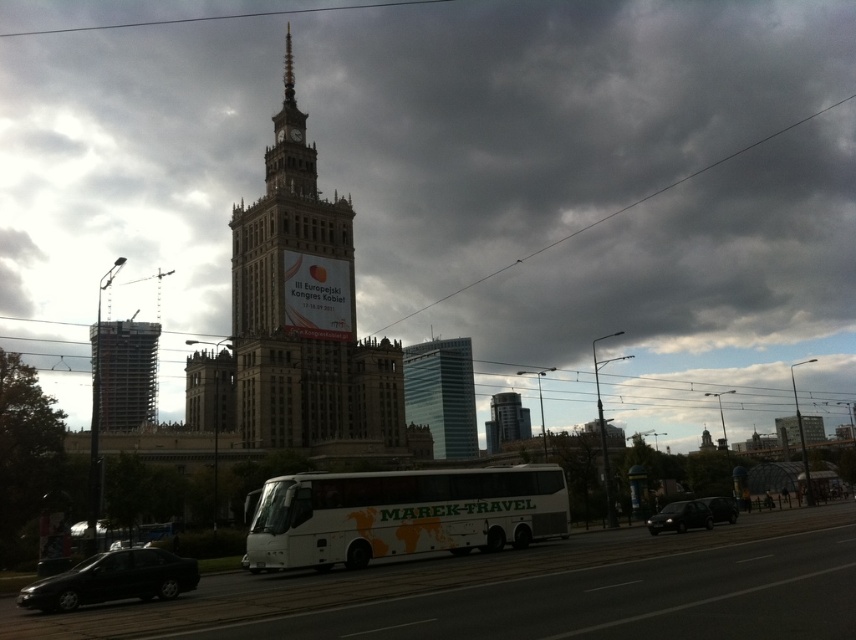
Can you confirm if matte gray skyscraper at center is smaller than shiny black sedan at lower left?

No, matte gray skyscraper at center is not smaller than shiny black sedan at lower left.

Looking at this image, does matte gray skyscraper at center have a lesser width compared to shiny black sedan at lower left?

In fact, matte gray skyscraper at center might be wider than shiny black sedan at lower left.

Does point (310, 4) lie behind point (122, 566)?

Yes, it is.

You are a GUI agent. You are given a task and a screenshot of the screen. Output one action in this format:
    pyautogui.click(x=<x>, y=<y>)
    Task: Click on the matte gray skyscraper at center
    
    Given the screenshot: What is the action you would take?
    pyautogui.click(x=461, y=180)

Which is above, matte gray skyscraper at center or gray stone tower at center?

matte gray skyscraper at center

The height and width of the screenshot is (640, 856). What do you see at coordinates (461, 180) in the screenshot?
I see `matte gray skyscraper at center` at bounding box center [461, 180].

At what (x,y) coordinates should I click in order to perform the action: click on matte gray skyscraper at center. Please return your answer as a coordinate pair (x, y). This screenshot has height=640, width=856. Looking at the image, I should click on (461, 180).

Is shiny black sedan at lower left smaller than black glossy car at lower right?

Actually, shiny black sedan at lower left might be larger than black glossy car at lower right.

Between point (126, 580) and point (735, 518), which one is positioned behind?

The point (735, 518) is more distant.

Locate an element on the screen. shiny black sedan at lower left is located at coordinates (111, 579).